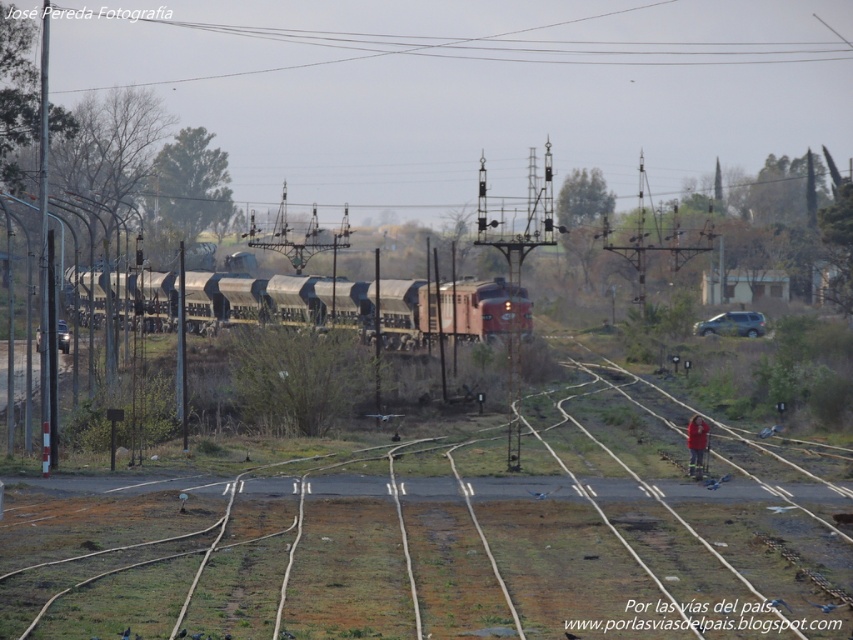
Question: Can you confirm if brown wooden track at center is positioned to the right of matte black train at center?

Choices:
 (A) yes
 (B) no

Answer: (A)

Question: Does matte black train at center have a larger size compared to red fabric jacket at lower right?

Choices:
 (A) no
 (B) yes

Answer: (B)

Question: Based on their relative distances, which object is nearer to the brown wooden track at center?

Choices:
 (A) matte black train at center
 (B) red fabric jacket at lower right

Answer: (B)

Question: Which point is farther from the camera taking this photo?

Choices:
 (A) (422, 579)
 (B) (701, 456)
 (C) (457, 317)

Answer: (C)

Question: Does matte black train at center appear on the right side of red fabric jacket at lower right?

Choices:
 (A) yes
 (B) no

Answer: (B)

Question: Estimate the real-world distances between objects in this image. Which object is farther from the matte black train at center?

Choices:
 (A) red fabric jacket at lower right
 (B) brown wooden track at center

Answer: (A)